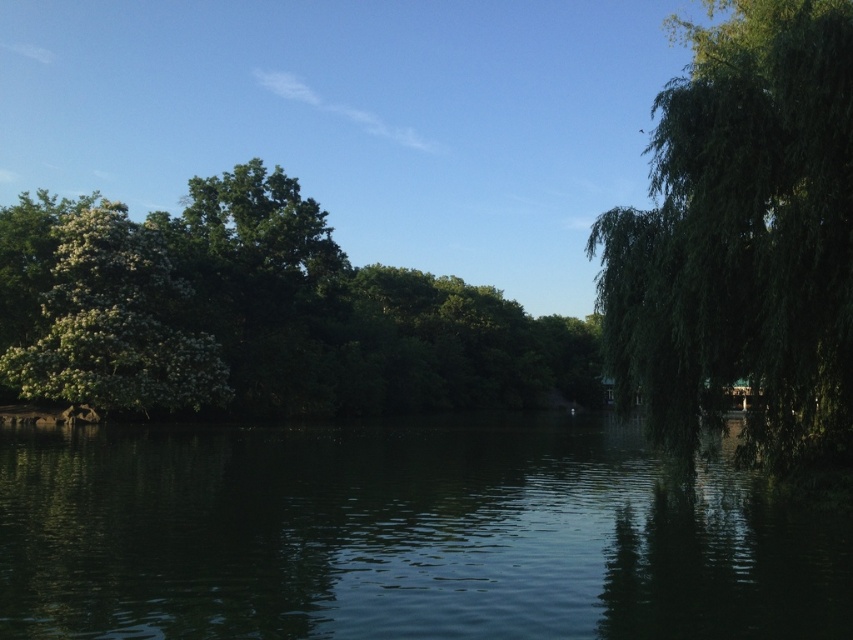
Question: Is green smooth water at center bigger than green leafy tree at right?

Choices:
 (A) no
 (B) yes

Answer: (A)

Question: Which object appears closest to the camera in this image?

Choices:
 (A) green leafy tree at left
 (B) green leafy tree at right
 (C) green smooth water at center

Answer: (C)

Question: Can you confirm if green smooth water at center is positioned below white fluffy tree at left?

Choices:
 (A) yes
 (B) no

Answer: (A)

Question: Considering the real-world distances, which object is closest to the green leafy tree at left?

Choices:
 (A) green smooth water at center
 (B) green leafy tree at right
 (C) white fluffy tree at left

Answer: (C)

Question: Which point is farther from the camera taking this photo?

Choices:
 (A) (184, 381)
 (B) (73, 472)

Answer: (A)

Question: In this image, where is green smooth water at center located relative to white fluffy tree at left?

Choices:
 (A) below
 (B) above

Answer: (A)